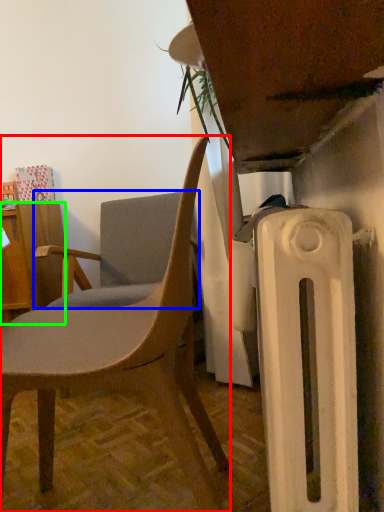
Question: Which object is positioned farthest from chair (highlighted by a red box)? Select from chair (highlighted by a blue box) and desk (highlighted by a green box).

Choices:
 (A) chair
 (B) desk

Answer: (B)